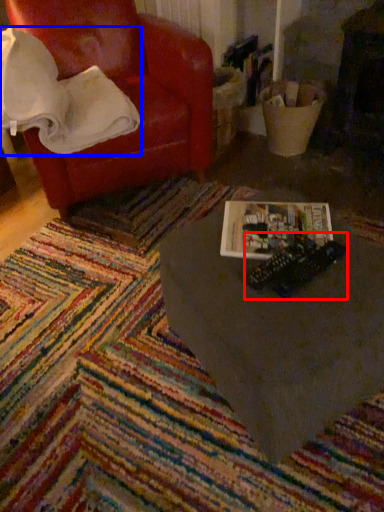
Question: Which of the following is the closest to the observer, toy (highlighted by a red box) or blanket (highlighted by a blue box)?

Choices:
 (A) toy
 (B) blanket

Answer: (A)